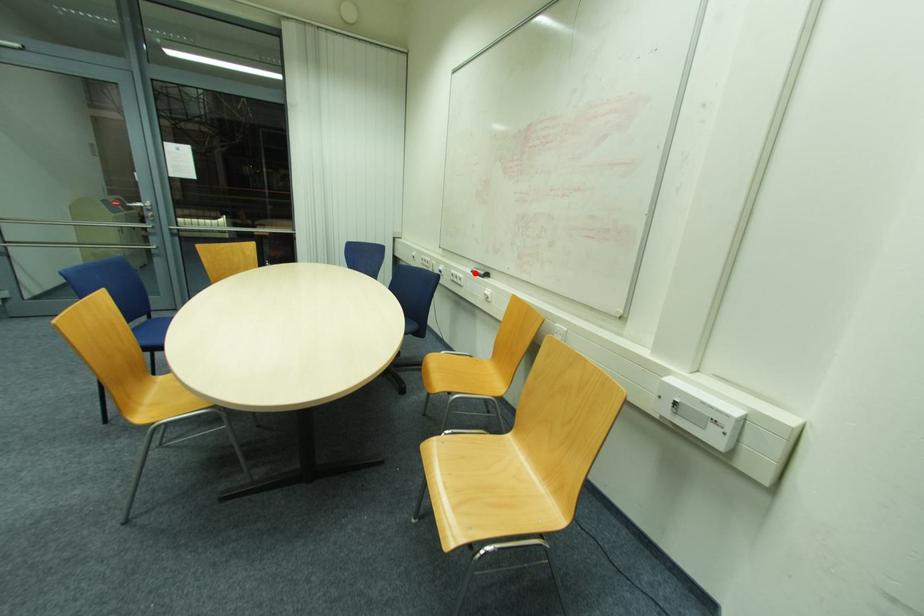
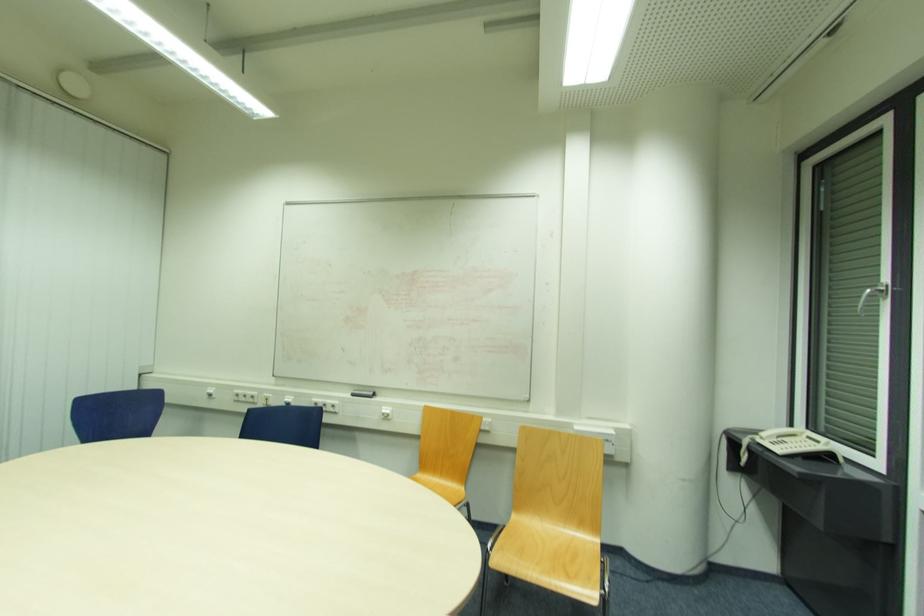
Where in the second image is the point corresponding to the highlighted location from the first image?

(355, 395)